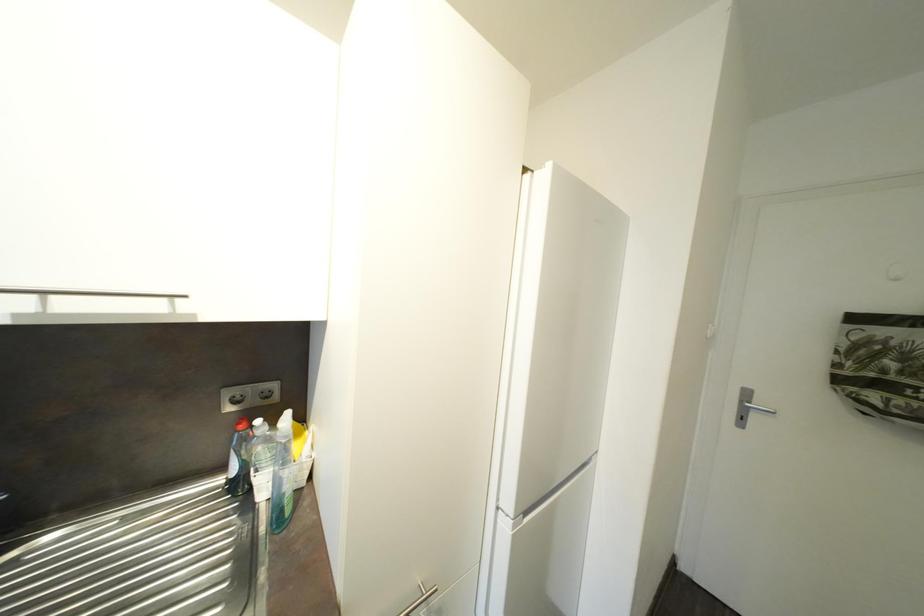
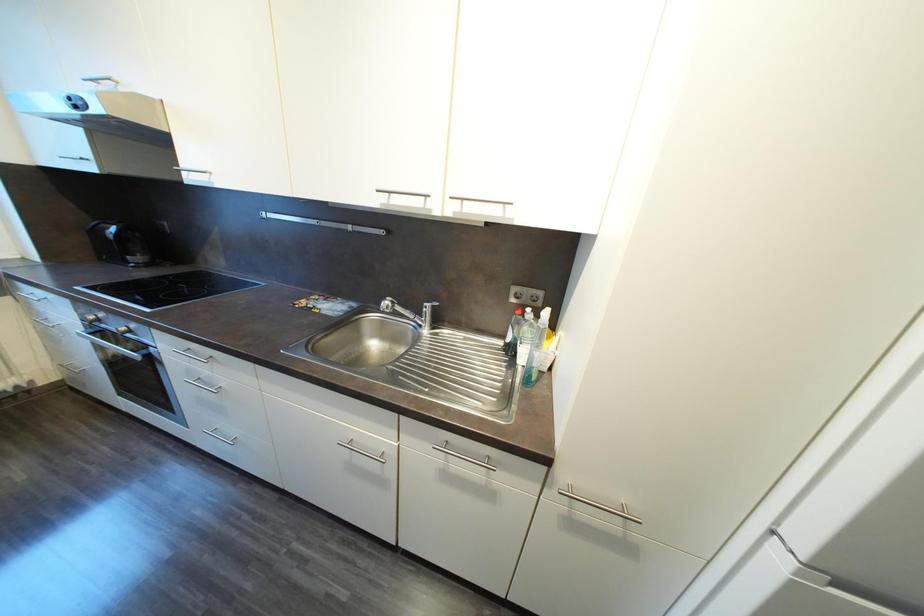
Question: The camera is either moving clockwise (left) or counter-clockwise (right) around the object. The first image is from the beginning of the video and the second image is from the end. Is the camera moving left or right when shooting the video?

Choices:
 (A) Left
 (B) Right

Answer: (B)